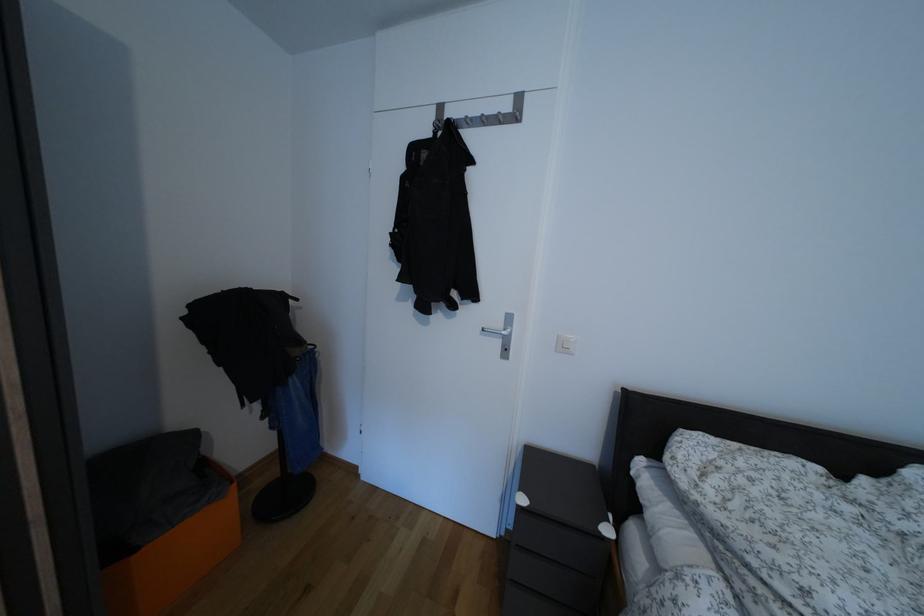
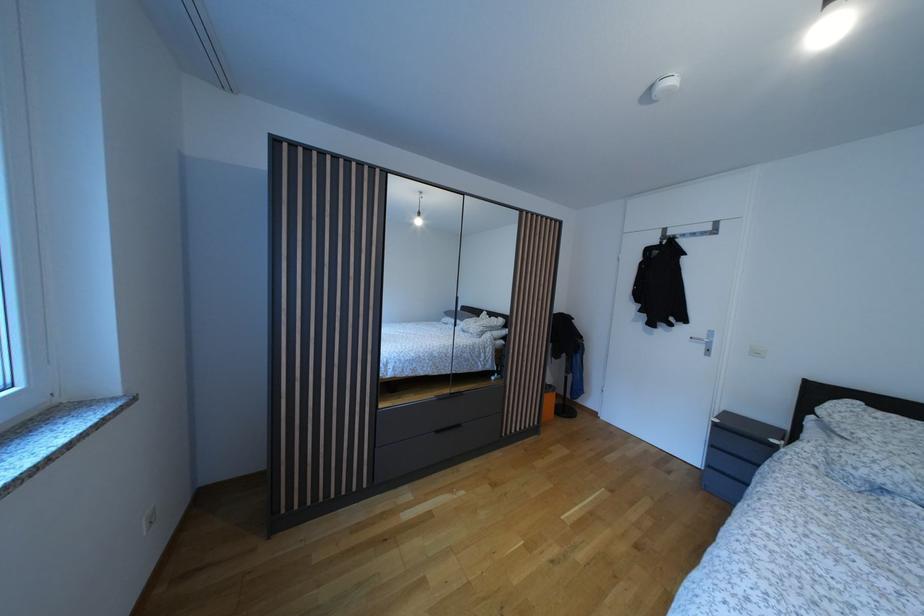
Find the pixel in the second image that matches the point at 529,506 in the first image.

(723, 427)